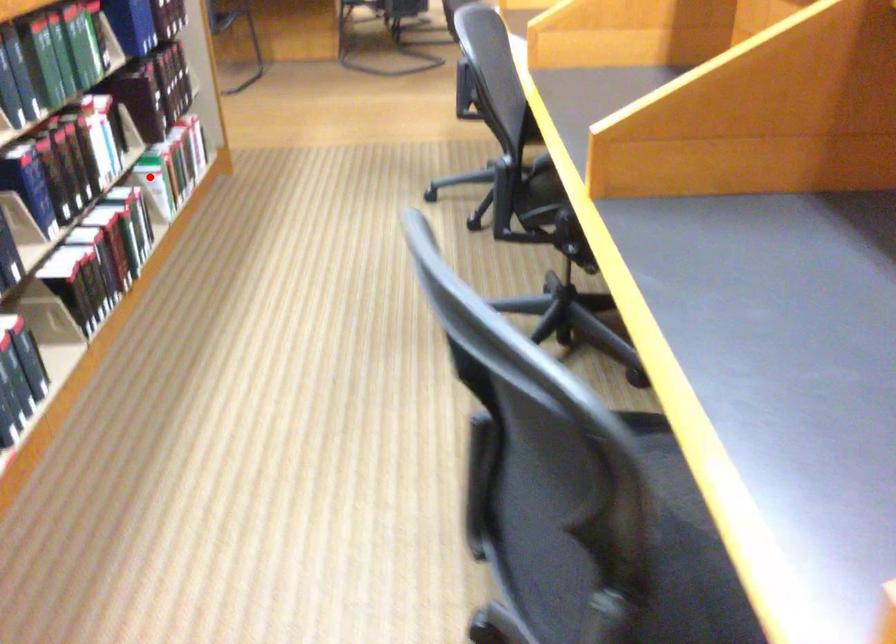
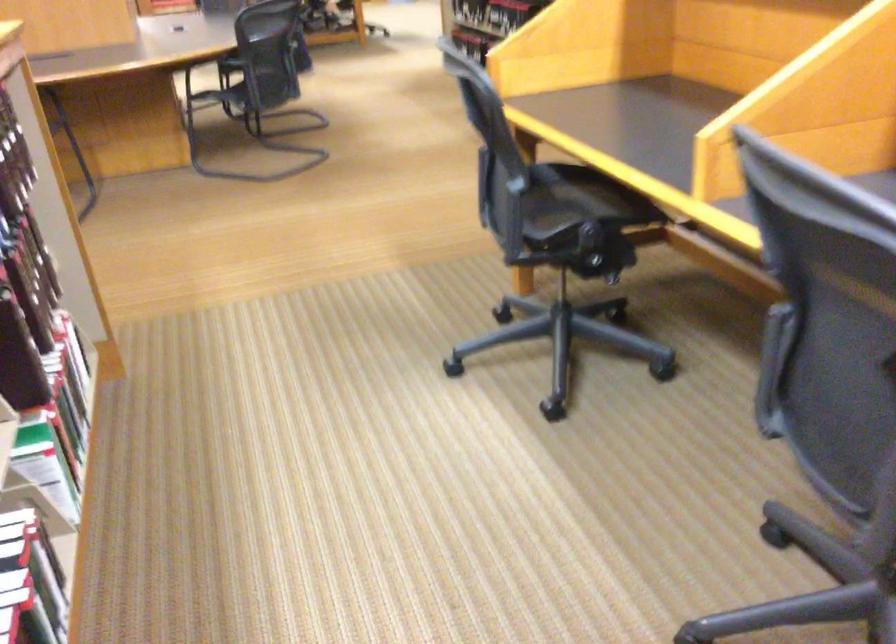
Question: I am providing you with two images of the same scene from different viewpoints. Given a red point in image1, look at the same physical point in image2. Is it:

Choices:
 (A) Closer to the viewpoint
 (B) Farther from the viewpoint

Answer: (A)